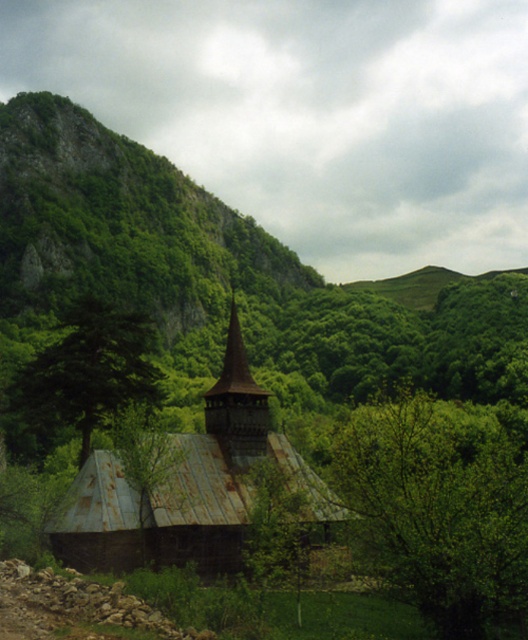
Question: Which of these objects is positioned farthest from the rusty metal church at center?

Choices:
 (A) green leafy tree at center
 (B) green matte tree at center-left

Answer: (A)

Question: Can you confirm if green leafy tree at center is bigger than dark brown wooden spire at center?

Choices:
 (A) no
 (B) yes

Answer: (B)

Question: Is green leafy tree at center closer to the viewer compared to dark brown wooden spire at center?

Choices:
 (A) no
 (B) yes

Answer: (B)

Question: Is green leafy tree at center smaller than green matte tree at center-left?

Choices:
 (A) yes
 (B) no

Answer: (B)

Question: Which point is closer to the camera?

Choices:
 (A) (70, 508)
 (B) (67, 401)

Answer: (A)

Question: Which of the following is the closest to the observer?

Choices:
 (A) green matte tree at center-left
 (B) green leafy tree at center
 (C) rusty metal church at center
 (D) dark brown wooden spire at center

Answer: (B)